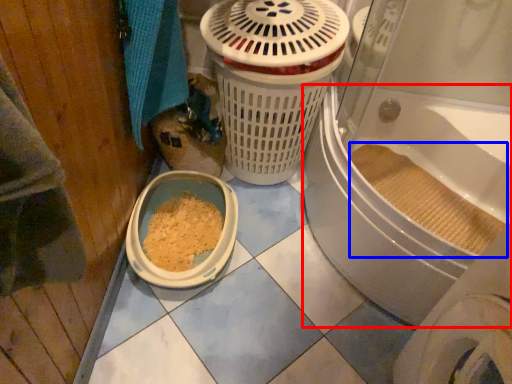
Question: Which object appears farthest to the camera in this image, bath (highlighted by a red box) or debris (highlighted by a blue box)?

Choices:
 (A) bath
 (B) debris

Answer: (B)